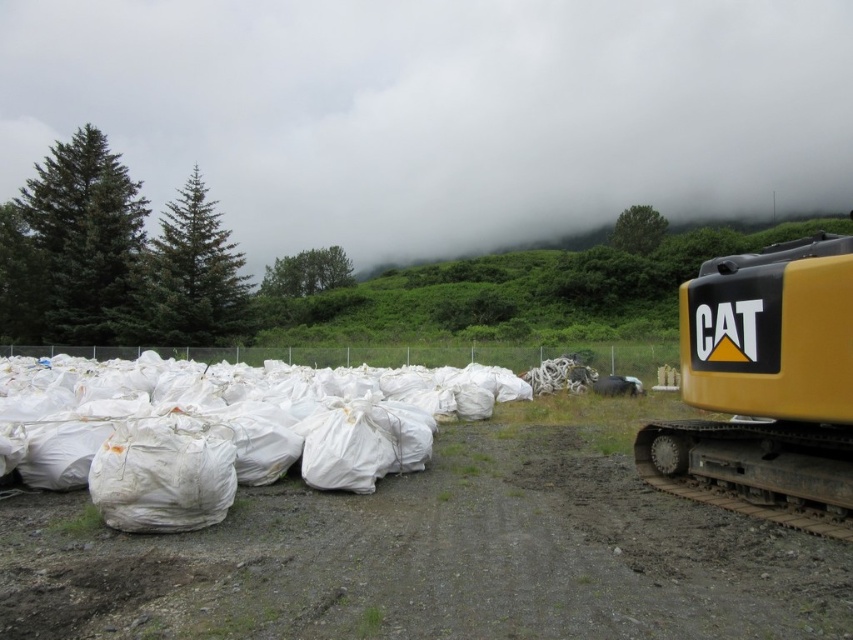
Does white fabric bags at left have a lesser width compared to yellow rubber track at right?

No, white fabric bags at left is not thinner than yellow rubber track at right.

What do you see at coordinates (231, 426) in the screenshot? This screenshot has height=640, width=853. I see `white fabric bags at left` at bounding box center [231, 426].

Where is `white fabric bags at left`? This screenshot has height=640, width=853. white fabric bags at left is located at coordinates (231, 426).

Is dull brown dirt track at lower center below yellow rubber track at right?

Indeed, dull brown dirt track at lower center is positioned under yellow rubber track at right.

Is dull brown dirt track at lower center shorter than yellow rubber track at right?

Yes.

Is point (643, 570) positioned behind point (708, 320)?

No, it is in front of (708, 320).

At what (x,y) coordinates should I click in order to perform the action: click on dull brown dirt track at lower center. Please return your answer as a coordinate pair (x, y). The image size is (853, 640). Looking at the image, I should click on pyautogui.click(x=431, y=560).

Does dull brown dirt track at lower center have a lesser height compared to white fabric bags at left?

Correct, dull brown dirt track at lower center is not as tall as white fabric bags at left.

Who is taller, dull brown dirt track at lower center or white fabric bags at left?

With more height is white fabric bags at left.

The image size is (853, 640). What are the coordinates of `dull brown dirt track at lower center` in the screenshot? It's located at (431, 560).